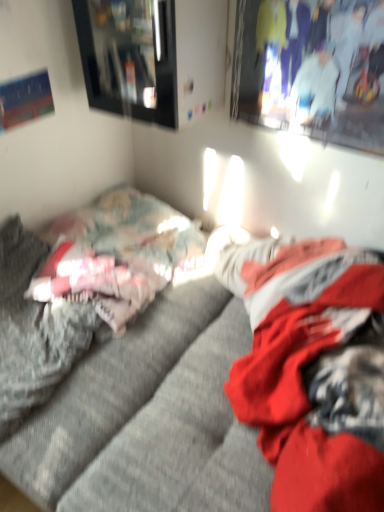
Question: Looking at the image, does textured gray couch at center seem bigger or smaller compared to fluffy gray bed at left?

Choices:
 (A) small
 (B) big

Answer: (B)

Question: Is textured gray couch at center inside the boundaries of fluffy gray bed at left, or outside?

Choices:
 (A) outside
 (B) inside

Answer: (A)

Question: Which object is the farthest from the textured gray couch at center?

Choices:
 (A) matte black picture frame at upper left
 (B) fluffy gray bed at left
 (C) matte white couple at upper right

Answer: (C)

Question: Which object is the farthest from the fluffy gray bed at left?

Choices:
 (A) matte black picture frame at upper left
 (B) matte white couple at upper right
 (C) textured gray couch at center

Answer: (B)